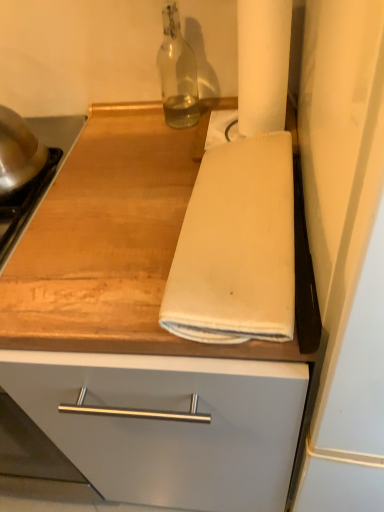
Where is `free area in between transparent glass bottle at upper center and white cotton towel at center`? This screenshot has width=384, height=512. free area in between transparent glass bottle at upper center and white cotton towel at center is located at coordinates (178, 176).